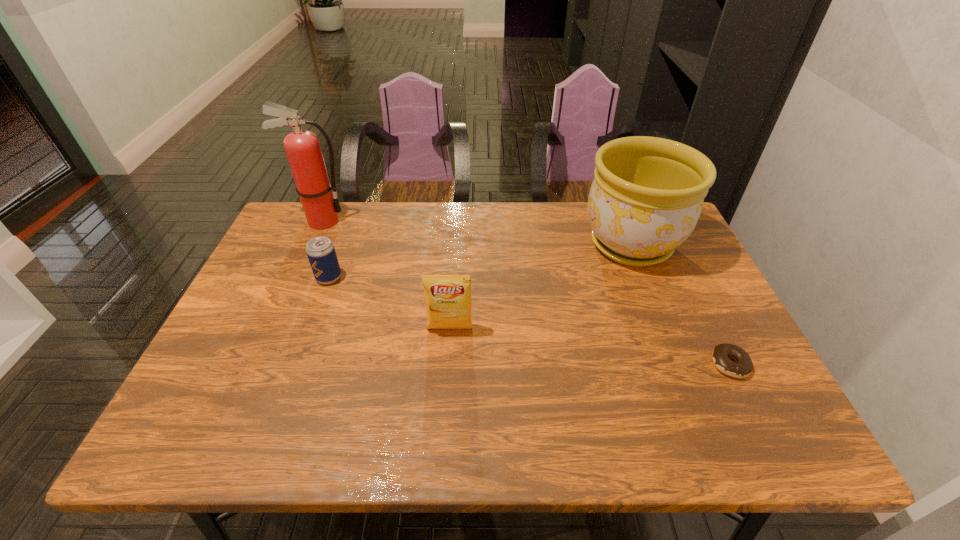
Image resolution: width=960 pixels, height=540 pixels. Identify the location of free space located on the right of the fourth tallest object. (396, 278).

Locate an element on the screen. free spot located on the left of the nearest object is located at coordinates (671, 364).

Locate an element on the screen. The image size is (960, 540). fire extinguisher that is at the far edge is located at coordinates (321, 207).

This screenshot has width=960, height=540. Identify the location of flowerpot at the far edge. (646, 197).

Where is `object present at the left edge`? object present at the left edge is located at coordinates (321, 207).

Where is `flowerpot that is at the right edge`? flowerpot that is at the right edge is located at coordinates (646, 197).

Identify the location of doughnut that is at the right edge. The width and height of the screenshot is (960, 540). (721, 355).

Identify the location of object at the far left corner. The width and height of the screenshot is (960, 540). (321, 207).

Locate an element on the screen. This screenshot has height=540, width=960. object that is at the far right corner is located at coordinates (646, 197).

Where is `free space at the far edge of the desktop`? free space at the far edge of the desktop is located at coordinates (416, 201).